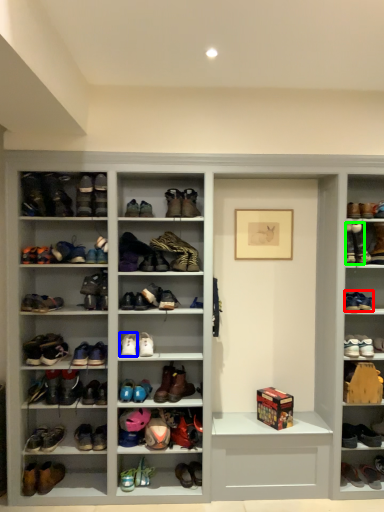
Question: Which is nearer to the footwear (highlighted by a red box)? footwear (highlighted by a blue box) or footwear (highlighted by a green box).

Choices:
 (A) footwear
 (B) footwear

Answer: (B)